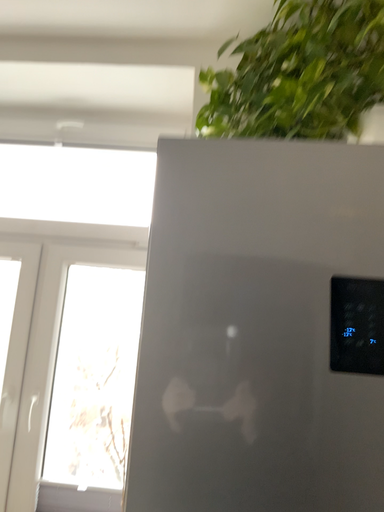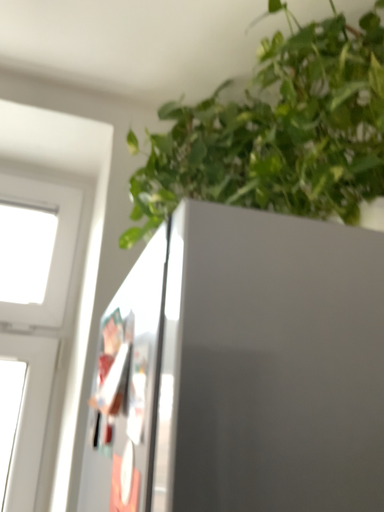
Question: How did the camera likely rotate when shooting the video?

Choices:
 (A) rotated downward
 (B) rotated upward

Answer: (B)